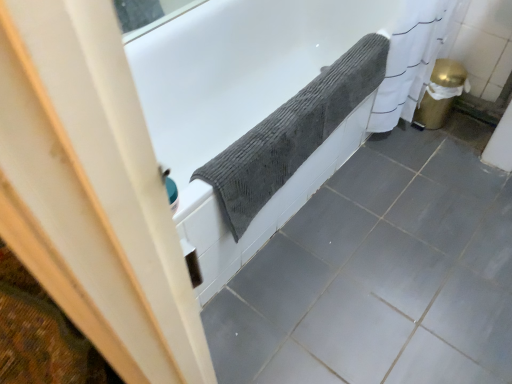
Question: Is gray textured towel at upper center positioned with its back to textured gray towel at upper center, positioned as the second ceramic tile in top-to-bottom order?

Choices:
 (A) no
 (B) yes

Answer: (A)

Question: Can you confirm if gray textured towel at upper center is shorter than textured gray towel at upper center, the 1th ceramic tile ordered from the bottom?

Choices:
 (A) no
 (B) yes

Answer: (A)

Question: From a real-world perspective, is gray textured towel at upper center below textured gray towel at upper center, positioned as the second ceramic tile in top-to-bottom order?

Choices:
 (A) no
 (B) yes

Answer: (A)

Question: Is gray textured towel at upper center bigger than textured gray towel at upper center, the 1th ceramic tile ordered from the bottom?

Choices:
 (A) no
 (B) yes

Answer: (B)

Question: From a real-world perspective, is gray textured towel at upper center located higher than textured gray towel at upper center, the 1th ceramic tile ordered from the bottom?

Choices:
 (A) no
 (B) yes

Answer: (B)

Question: Does gray textured towel at upper center have a greater width compared to textured gray towel at upper center, positioned as the second ceramic tile in top-to-bottom order?

Choices:
 (A) no
 (B) yes

Answer: (A)

Question: Does gray textured towel at upper center have a greater width compared to textured gray towel at upper center, the 1th ceramic tile ordered from the bottom?

Choices:
 (A) yes
 (B) no

Answer: (B)

Question: From the image's perspective, is gray textured towel at upper center on top of textured gray towel at upper center, positioned as the second ceramic tile in top-to-bottom order?

Choices:
 (A) no
 (B) yes

Answer: (B)

Question: From a real-world perspective, is gray textured towel at upper center under textured gray towel at upper center, the 1th ceramic tile ordered from the bottom?

Choices:
 (A) yes
 (B) no

Answer: (B)

Question: Is gray textured towel at upper center smaller than textured gray towel at upper center, the 1th ceramic tile ordered from the bottom?

Choices:
 (A) no
 (B) yes

Answer: (A)

Question: Is the surface of gray textured towel at upper center in direct contact with textured gray towel at upper center, positioned as the second ceramic tile in top-to-bottom order?

Choices:
 (A) yes
 (B) no

Answer: (B)

Question: Is gray textured towel at upper center turned away from textured gray towel at upper center, the 1th ceramic tile ordered from the bottom?

Choices:
 (A) yes
 (B) no

Answer: (B)

Question: Is gray matte ceramic tile at lower center, positioned as the 1th ceramic tile in top-to-bottom order, outside textured gray towel at upper center, positioned as the second ceramic tile in top-to-bottom order?

Choices:
 (A) no
 (B) yes

Answer: (A)